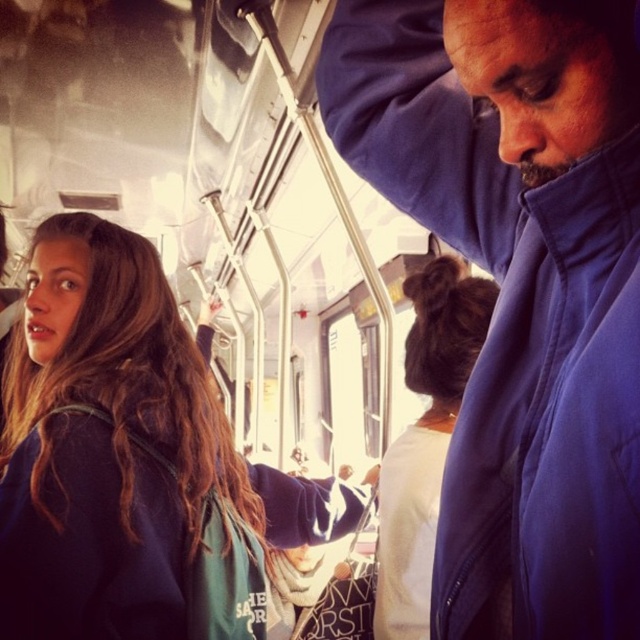
You are a passenger on a bus and you see two people in front of you. One has brown hair at upper left and the other has brown fuzzy hair at upper center. Which person is closer to you?

The brown hair at upper left is below brown fuzzy hair at upper center, so the brown hair at upper left is closer to you because it is positioned lower in the visual field.